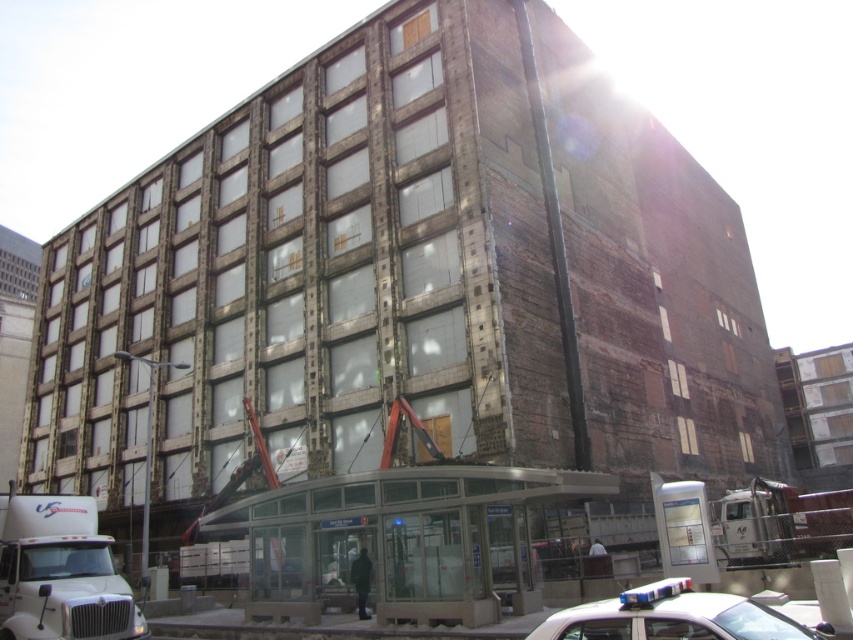
Is white plastic car at lower right below white metallic truck at lower right?

Actually, white plastic car at lower right is above white metallic truck at lower right.

Identify the location of white plastic car at lower right. This screenshot has height=640, width=853. (672, 616).

Which is behind, point (672, 620) or point (845, 538)?

The point (845, 538) is more distant.

Locate an element on the screen. The width and height of the screenshot is (853, 640). white plastic car at lower right is located at coordinates (672, 616).

In the scene shown: Is white matte truck at lower left positioned before white metallic truck at lower right?

Yes.

Between point (9, 547) and point (788, 557), which one is positioned behind?

Point (788, 557)

Who is more forward, [61,584] or [734,512]?

A: Point [61,584] is in front.

You are a GUI agent. You are given a task and a screenshot of the screen. Output one action in this format:
    pyautogui.click(x=<x>, y=<y>)
    Task: Click on the white matte truck at lower left
    The image size is (853, 640).
    Given the screenshot: What is the action you would take?
    pyautogui.click(x=61, y=572)

Can you confirm if white matte truck at lower left is positioned above white plastic car at lower right?

Actually, white matte truck at lower left is below white plastic car at lower right.

Is white matte truck at lower left to the right of white plastic car at lower right from the viewer's perspective?

No, white matte truck at lower left is not to the right of white plastic car at lower right.

Locate an element on the screen. The width and height of the screenshot is (853, 640). white matte truck at lower left is located at coordinates (61, 572).